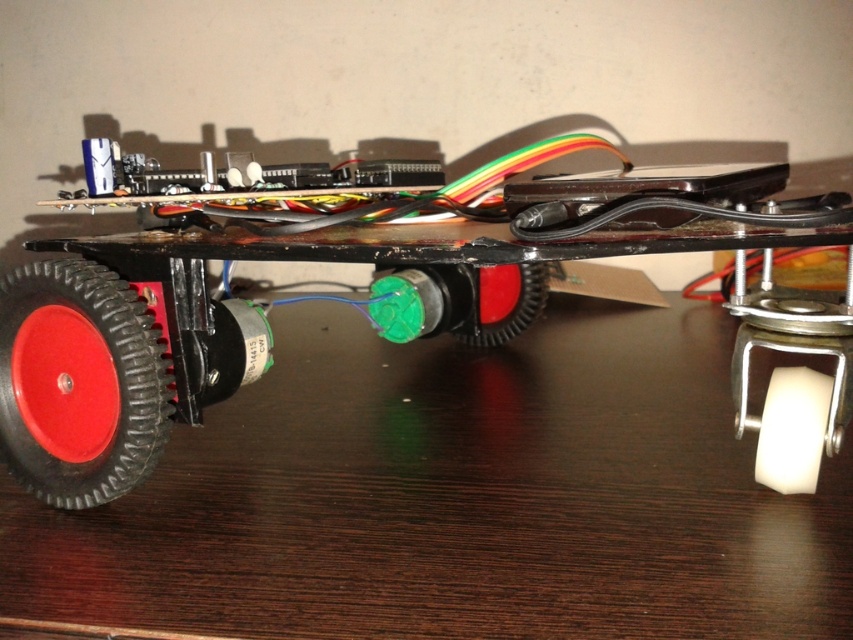
Question: Which of the following is the closest to the observer?

Choices:
 (A) rubber/textured wheel at lower left
 (B) rubberized black toy car at left
 (C) rubber/textured wheel at center

Answer: (B)

Question: Does rubberized black toy car at left appear on the right side of rubber/textured wheel at center?

Choices:
 (A) no
 (B) yes

Answer: (B)

Question: Does rubberized black toy car at left appear under rubber/textured wheel at lower left?

Choices:
 (A) no
 (B) yes

Answer: (A)

Question: Which object is positioned farthest from the rubber/textured wheel at center?

Choices:
 (A) rubber/textured wheel at lower left
 (B) rubberized black toy car at left

Answer: (A)

Question: Does rubberized black toy car at left appear over rubber/textured wheel at center?

Choices:
 (A) no
 (B) yes

Answer: (B)

Question: Which is nearer to the rubber/textured wheel at center?

Choices:
 (A) rubber/textured wheel at lower left
 (B) rubberized black toy car at left

Answer: (B)